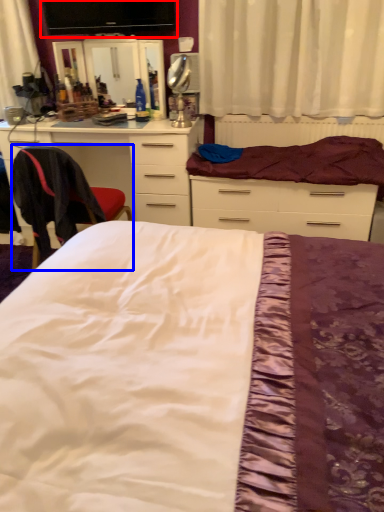
Question: Which object appears farthest to the camera in this image, computer monitor (highlighted by a red box) or chair (highlighted by a blue box)?

Choices:
 (A) computer monitor
 (B) chair

Answer: (A)